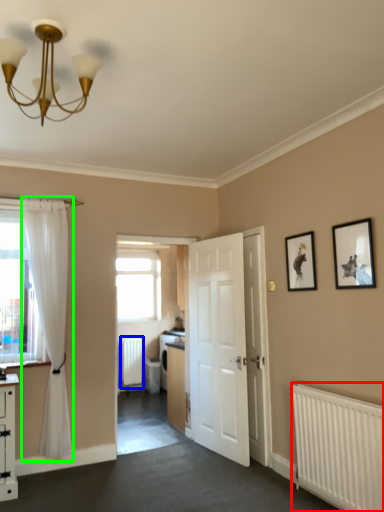
Question: Estimate the real-world distances between objects in this image. Which object is closer to radiator (highlighted by a red box), radiator (highlighted by a blue box) or curtain (highlighted by a green box)?

Choices:
 (A) radiator
 (B) curtain

Answer: (B)